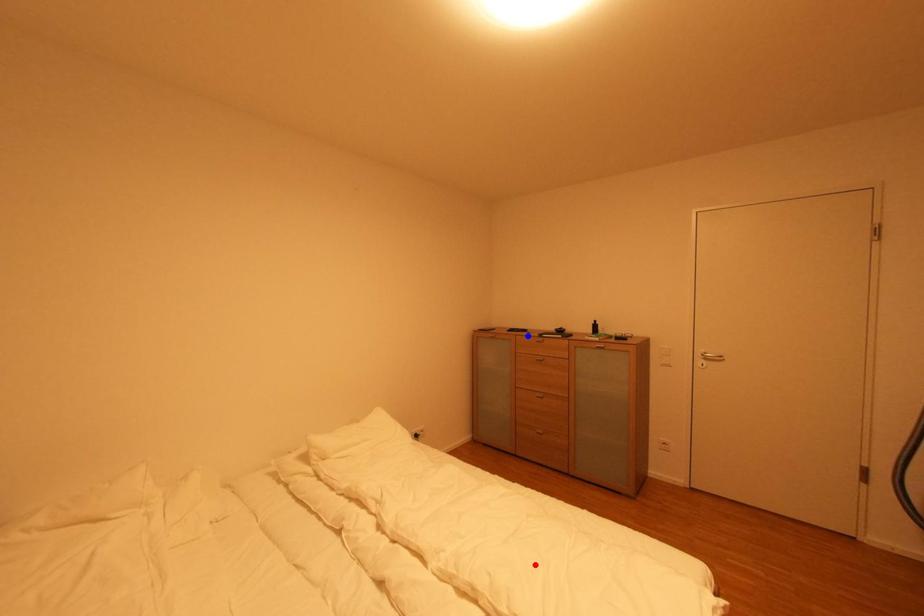
Question: In the image, two points are highlighted. Which point is nearer to the camera? Reply with the corresponding letter.

Choices:
 (A) blue point
 (B) red point

Answer: (B)